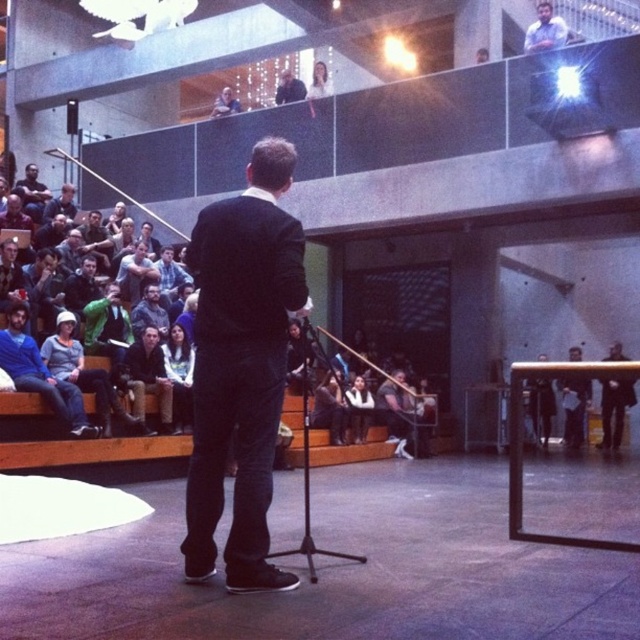
From the picture: You are sitting at the dark gray fabric seats at left and want to move to the stage where the man is presenting. Which direction should you walk to reach the stage?

The dark gray fabric seats at left is located at point (88, 451), so you should walk towards the center or right to reach the stage where the man is presenting.

Consider the image. You are organizing a small event and need to determine seating arrangements. You have two options for seating areas in the venue described. The first option uses dark gray fabric seats at left, and the second uses dark blue jeans at center. Which seating option takes up more space?

Result: The dark blue jeans at center takes up more space than the dark gray fabric seats at left because the dark gray fabric seats at left occupies less space than dark blue jeans at center.

You are sitting in the dark gray fabric seats at left and want to see the dark blue suit at upper center. Can you see it without moving your head?

The dark gray fabric seats at left is closer to the viewer than dark blue suit at upper center, so you can see the dark blue suit at upper center from your position without moving your head.